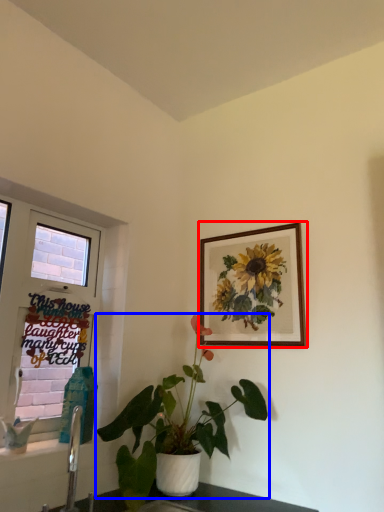
Question: Which of the following is the closest to the observer, picture frame (highlighted by a red box) or houseplant (highlighted by a blue box)?

Choices:
 (A) picture frame
 (B) houseplant

Answer: (B)